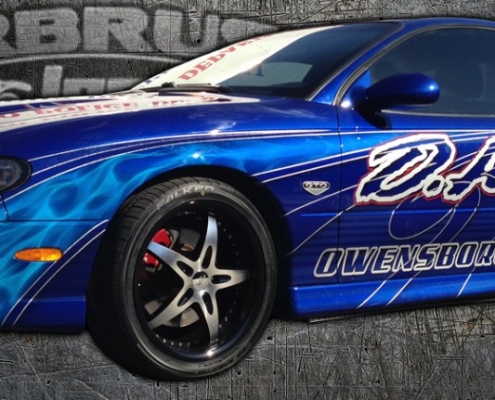
Identify the location of wall. This screenshot has width=495, height=400. (159, 23).